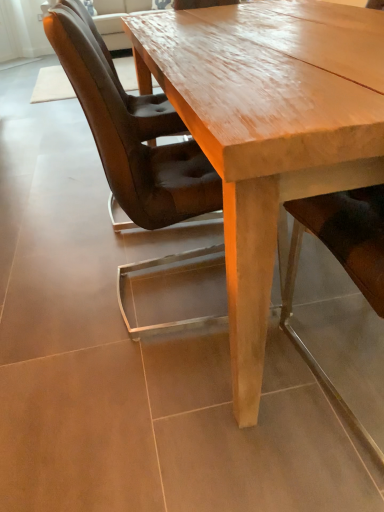
Question: Can you confirm if brown leather chair at left, the first chair viewed from the back, is smaller than light brown polished wood table at center?

Choices:
 (A) no
 (B) yes

Answer: (B)

Question: From a real-world perspective, is brown leather chair at left, which ranks as the 1th chair in left-to-right order, physically below light brown polished wood table at center?

Choices:
 (A) yes
 (B) no

Answer: (B)

Question: Is brown leather chair at left, which ranks as the 1th chair in left-to-right order, beside light brown polished wood table at center?

Choices:
 (A) no
 (B) yes

Answer: (A)

Question: Does brown leather chair at left, which ranks as the 1th chair in left-to-right order, appear on the left side of light brown polished wood table at center?

Choices:
 (A) no
 (B) yes

Answer: (B)

Question: Is brown leather chair at left, which is the second chair in front-to-back order, facing away from light brown polished wood table at center?

Choices:
 (A) no
 (B) yes

Answer: (B)

Question: Is brown leather chair at left, which appears as the second chair when viewed from the right, far from light brown polished wood table at center?

Choices:
 (A) yes
 (B) no

Answer: (B)

Question: Considering the relative sizes of smooth leather chair at center, positioned as the second chair in back-to-front order, and light brown polished wood table at center in the image provided, is smooth leather chair at center, positioned as the second chair in back-to-front order, wider than light brown polished wood table at center?

Choices:
 (A) yes
 (B) no

Answer: (B)

Question: Is smooth leather chair at center, positioned as the second chair in back-to-front order, turned away from light brown polished wood table at center?

Choices:
 (A) yes
 (B) no

Answer: (A)

Question: From a real-world perspective, is smooth leather chair at center, the 1th chair from the right, on light brown polished wood table at center?

Choices:
 (A) yes
 (B) no

Answer: (A)

Question: Considering the relative sizes of smooth leather chair at center, which is the 2th chair from left to right, and light brown polished wood table at center in the image provided, is smooth leather chair at center, which is the 2th chair from left to right, shorter than light brown polished wood table at center?

Choices:
 (A) yes
 (B) no

Answer: (B)

Question: Can you confirm if smooth leather chair at center, which is the 2th chair from left to right, is taller than light brown polished wood table at center?

Choices:
 (A) yes
 (B) no

Answer: (A)

Question: Is smooth leather chair at center, the first chair when ordered from front to back, directly adjacent to light brown polished wood table at center?

Choices:
 (A) yes
 (B) no

Answer: (B)

Question: Is smooth leather chair at center, positioned as the second chair in back-to-front order, shorter than brown leather chair at left, which ranks as the 1th chair in left-to-right order?

Choices:
 (A) yes
 (B) no

Answer: (B)